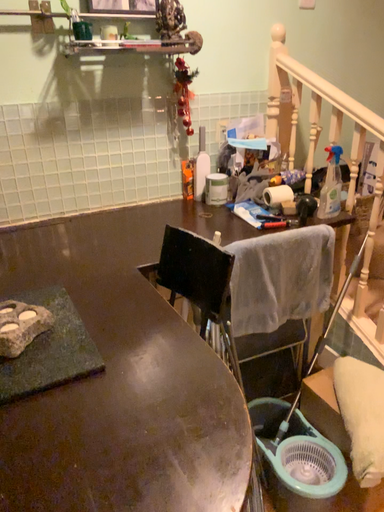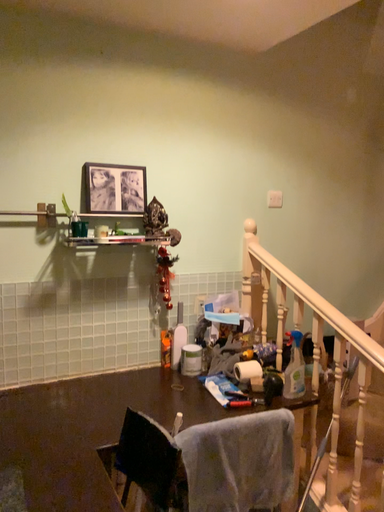
Question: How did the camera likely rotate when shooting the video?

Choices:
 (A) rotated upward
 (B) rotated downward

Answer: (A)